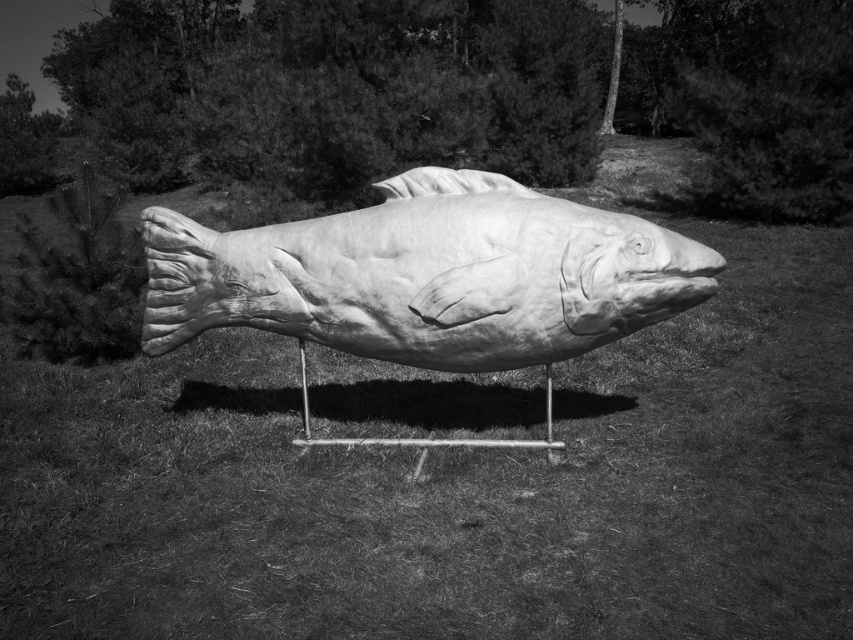
Who is more forward, (842, 460) or (199, 275)?

Point (842, 460) is more forward.

Is smooth grass at center in front of smooth wood fish at center?

Yes, it is.

This screenshot has width=853, height=640. I want to click on smooth grass at center, so click(454, 486).